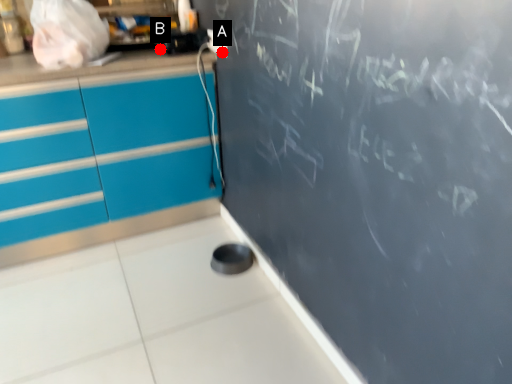
Question: Two points are circled on the image, labeled by A and B beside each circle. Which point is closer to the camera?

Choices:
 (A) A is closer
 (B) B is closer

Answer: (A)